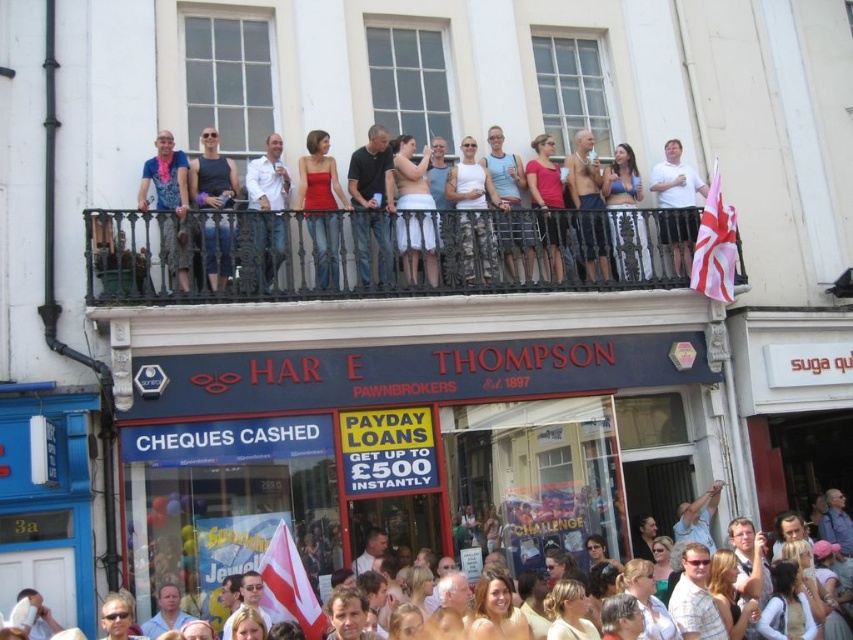
Who is taller, matte black dress at center or white cotton crowd at lower center?

matte black dress at center

Who is higher up, matte black dress at center or white cotton crowd at lower center?

matte black dress at center is above.

Who is more distant from viewer, (206, 202) or (585, 449)?

Point (585, 449)

The height and width of the screenshot is (640, 853). Identify the location of matte black dress at center. (432, 230).

Is matte red dress at center bigger than matte black tank top at center?

Yes, matte red dress at center is bigger than matte black tank top at center.

Is point (329, 260) positioned behind point (222, 172)?

No, it is in front of (222, 172).

Where is `matte red dress at center`? The height and width of the screenshot is (640, 853). matte red dress at center is located at coordinates coord(321,205).

Where is `matte red dress at center`? matte red dress at center is located at coordinates (321, 205).

Can you confirm if matte red dress at center is taller than matte blue bikini top at upper center?

Yes.

Which is behind, point (332, 250) or point (624, 272)?

The point (624, 272) is more distant.

This screenshot has height=640, width=853. In order to click on matte red dress at center in this screenshot , I will do `click(321, 205)`.